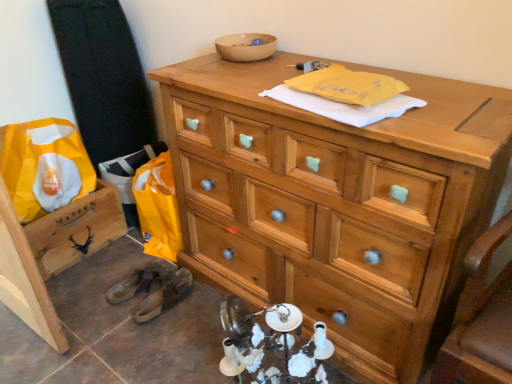
Question: Is wooden bowl at upper center oriented away from brown leather shoe at lower left, which is the 1th shoe in left-to-right order?

Choices:
 (A) yes
 (B) no

Answer: (B)

Question: Is wooden bowl at upper center bigger than brown leather shoe at lower left, which is the 1th shoe in left-to-right order?

Choices:
 (A) yes
 (B) no

Answer: (B)

Question: Considering the relative sizes of wooden bowl at upper center and brown leather shoe at lower left, the second shoe in the right-to-left sequence, in the image provided, is wooden bowl at upper center wider than brown leather shoe at lower left, the second shoe in the right-to-left sequence,?

Choices:
 (A) no
 (B) yes

Answer: (A)

Question: Considering the relative positions of wooden bowl at upper center and brown leather shoe at lower left, the second shoe in the right-to-left sequence, in the image provided, is wooden bowl at upper center behind brown leather shoe at lower left, the second shoe in the right-to-left sequence,?

Choices:
 (A) yes
 (B) no

Answer: (B)

Question: From the image's perspective, is wooden bowl at upper center beneath brown leather shoe at lower left, the second shoe in the right-to-left sequence?

Choices:
 (A) yes
 (B) no

Answer: (B)

Question: Does wooden bowl at upper center appear on the left side of brown leather shoe at lower left, the second shoe in the right-to-left sequence?

Choices:
 (A) no
 (B) yes

Answer: (A)

Question: Does wooden bowl at upper center have a greater height compared to yellow paper bag at lower left?

Choices:
 (A) no
 (B) yes

Answer: (A)

Question: Can you confirm if wooden bowl at upper center is shorter than yellow paper bag at lower left?

Choices:
 (A) yes
 (B) no

Answer: (A)

Question: Would you say wooden bowl at upper center is outside yellow paper bag at lower left?

Choices:
 (A) yes
 (B) no

Answer: (A)

Question: Is wooden bowl at upper center facing away from yellow paper bag at lower left?

Choices:
 (A) no
 (B) yes

Answer: (A)

Question: Is wooden bowl at upper center further to the viewer compared to yellow paper bag at lower left?

Choices:
 (A) no
 (B) yes

Answer: (A)

Question: Are wooden bowl at upper center and yellow paper bag at lower left far apart?

Choices:
 (A) no
 (B) yes

Answer: (A)

Question: From a real-world perspective, is wooden chest of drawers at upper center positioned over brown leather shoe at lower left, the first shoe when ordered from right to left, based on gravity?

Choices:
 (A) yes
 (B) no

Answer: (A)